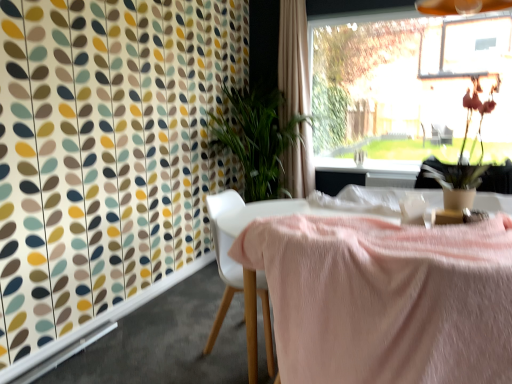
Locate an element on the screen. This screenshot has height=384, width=512. vacant space that is to the left of white plastic chair at center is located at coordinates (173, 346).